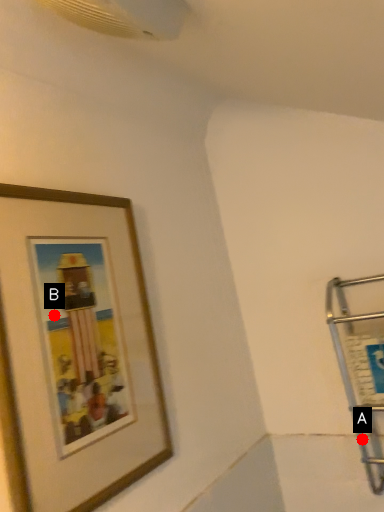
Question: Two points are circled on the image, labeled by A and B beside each circle. Which of the following is the closest to the observer?

Choices:
 (A) A is closer
 (B) B is closer

Answer: (B)